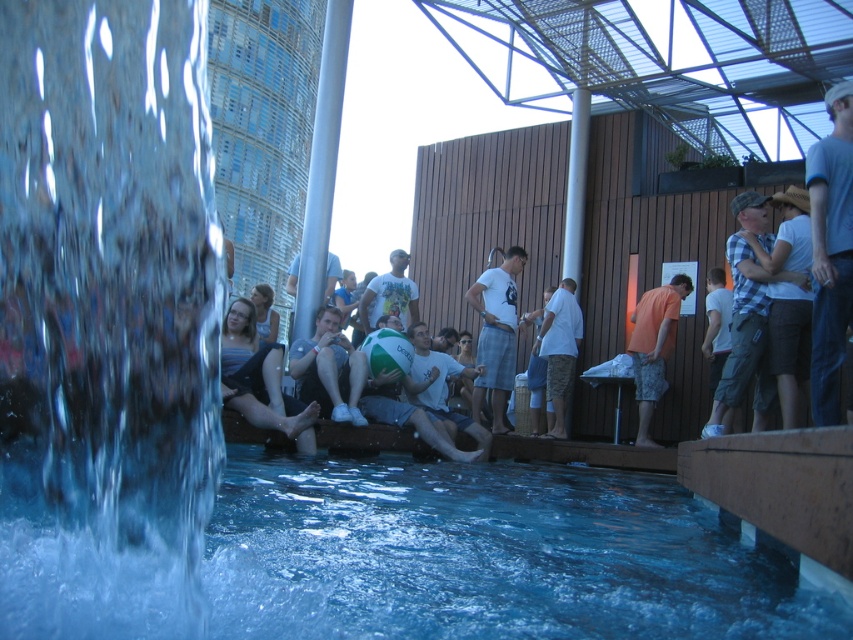
You are a photographer at the pool area and want to capture both the clear blue water at lower center and the plaid shirt at center in your shot. Which object will occupy more space in the photo?

The clear blue water at lower center will occupy more space in the photo because it has a larger size compared to the plaid shirt at center.

You are standing at the poolside and want to locate two specific points marked in the image. The first point is at coordinates point (711, 326) and the second is at point (276, 324). From your current position, which point is positioned further away from you?

Point (711, 326) is behind point (276, 324), so the first point is further away from you.